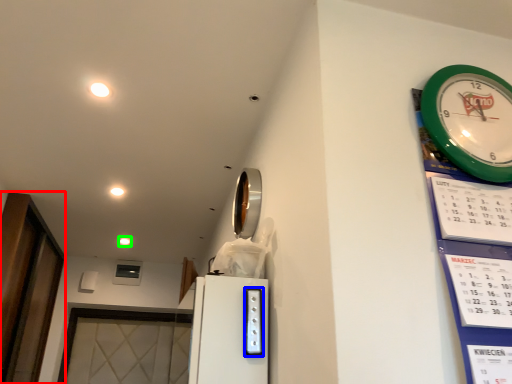
Question: Which is farther away from glass door (highlighted by a red box)? appliance (highlighted by a blue box) or light (highlighted by a green box)?

Choices:
 (A) appliance
 (B) light

Answer: (A)